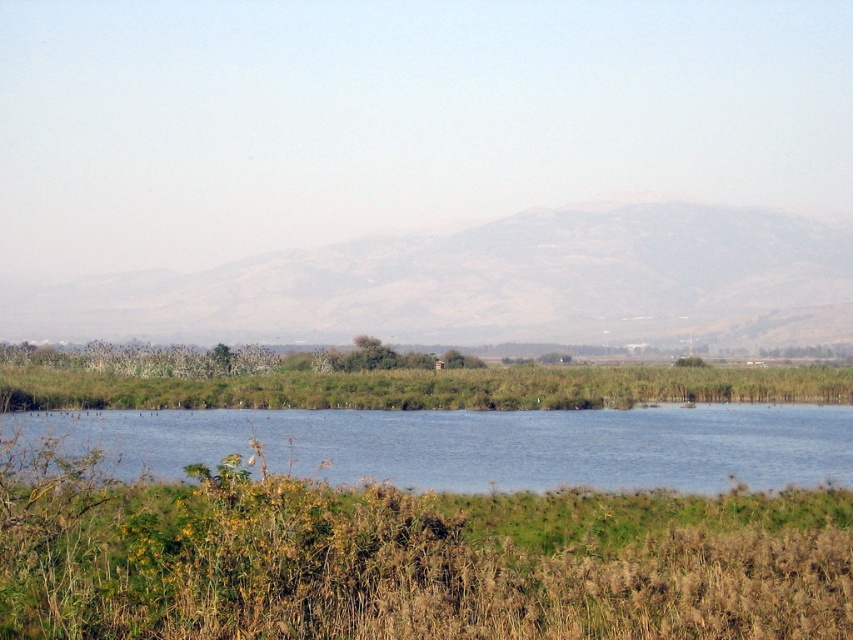
You are standing at the edge of the scene and want to walk towards the blue water at center and the green grassy reeds at center. Which one should you head towards if you want to reach the one closer to your current position?

The blue water at center is to the left of green grassy reeds at center, so if you are standing at the edge of the scene, the blue water at center is closer to your current position than the green grassy reeds at center. Therefore, you should head towards the blue water at center.